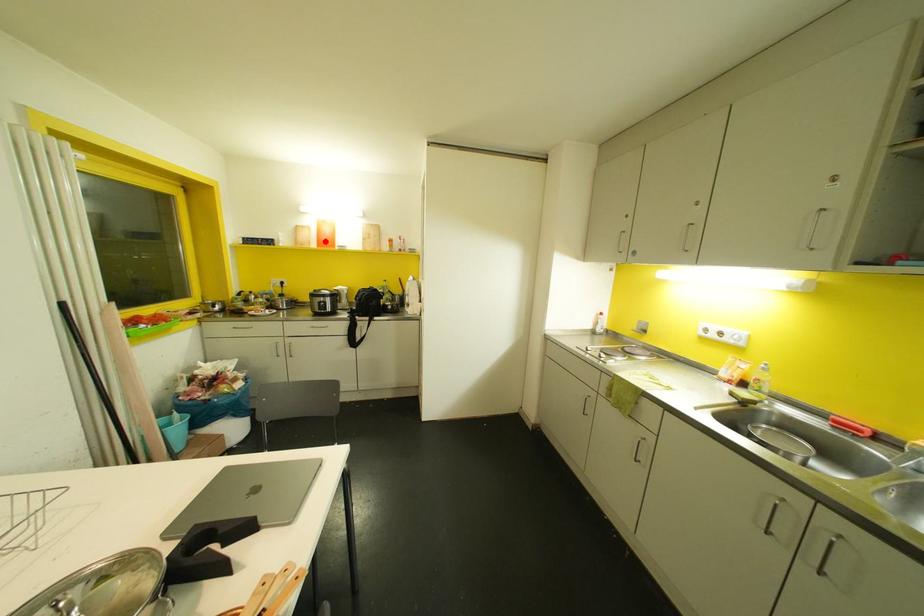
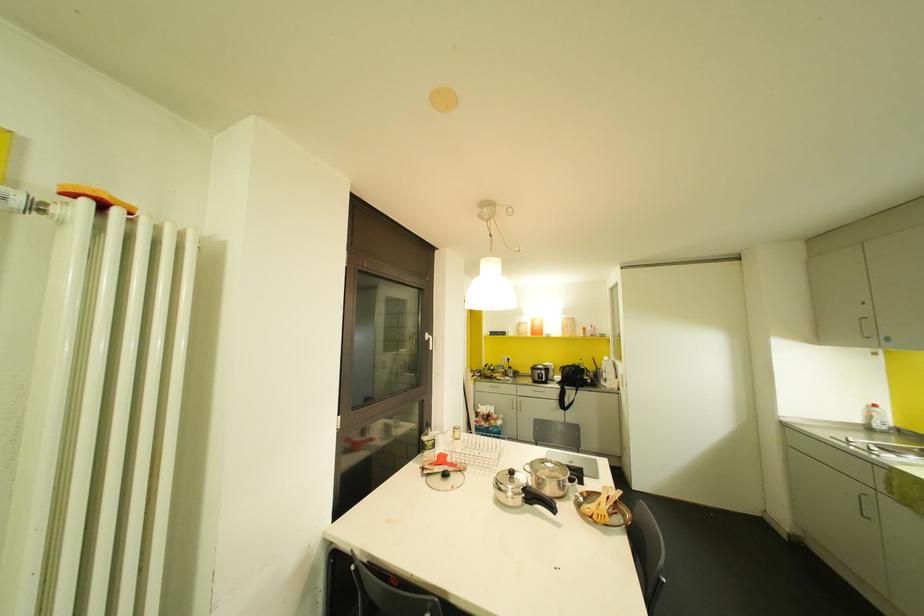
The point at the highlighted location is marked in the first image. Where is the corresponding point in the second image?

(536, 331)